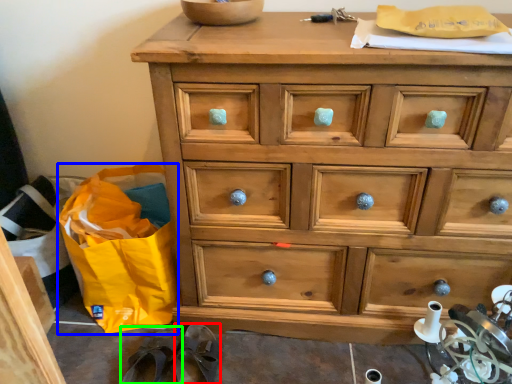
Question: Considering the real-world distances, which object is closest to slipper (highlighted by a red box)? shopping bag (highlighted by a blue box) or slipper (highlighted by a green box).

Choices:
 (A) shopping bag
 (B) slipper

Answer: (B)